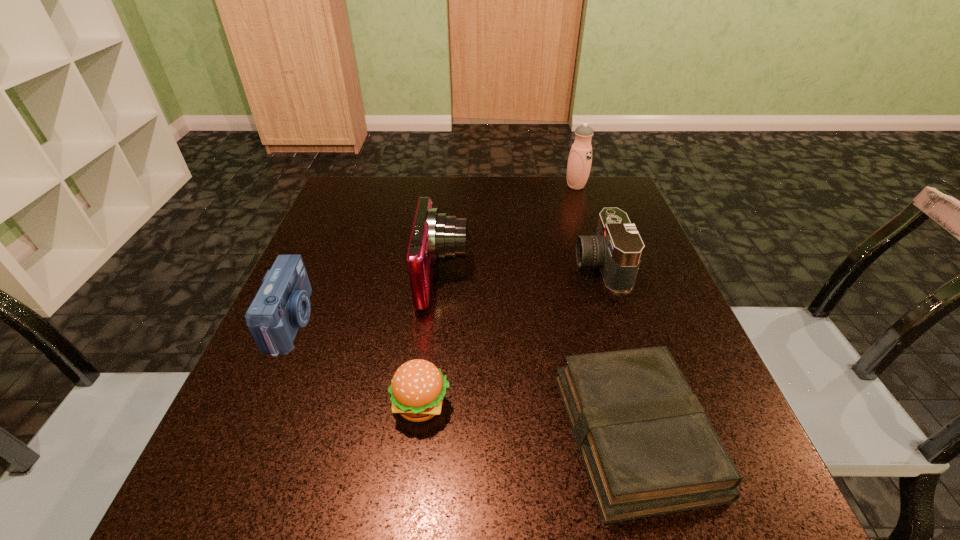
Where is `thermos bottle`? This screenshot has height=540, width=960. thermos bottle is located at coordinates (580, 157).

Image resolution: width=960 pixels, height=540 pixels. What are the coordinates of `the farthest object` in the screenshot? It's located at (580, 157).

The height and width of the screenshot is (540, 960). Identify the location of the tallest camera. (435, 237).

The image size is (960, 540). What are the coordinates of `the second camera from right to left` in the screenshot? It's located at (435, 237).

Find the location of a particular element. the rightmost camera is located at coordinates (617, 248).

This screenshot has width=960, height=540. In order to click on the leftmost object in this screenshot , I will do `click(282, 304)`.

Image resolution: width=960 pixels, height=540 pixels. Identify the location of the fifth tallest object. (418, 387).

Where is `the shortest object`? The image size is (960, 540). the shortest object is located at coordinates (648, 448).

At what (x,y) coordinates should I click in order to perform the action: click on free space located 0.400m on the left of the farthest object. Please return your answer as a coordinate pair (x, y). The width and height of the screenshot is (960, 540). Looking at the image, I should click on (419, 186).

Identify the location of free space located on the front-facing side of the second camera from left to right. (524, 278).